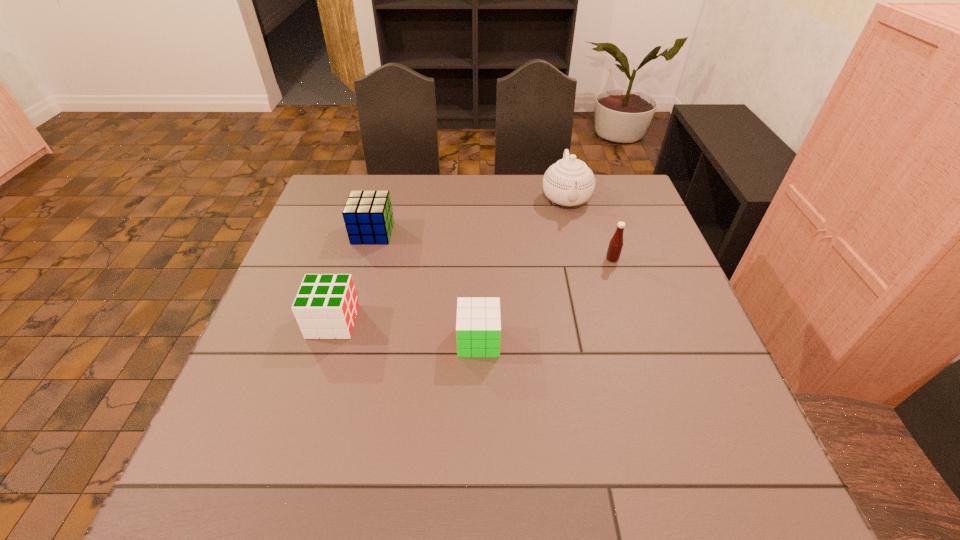
The image size is (960, 540). In order to click on free point that satisfies the following two spatial constraints: 1. on the spout of the tallest object; 2. on the right side of the third nearest object in this screenshot , I will do `click(581, 259)`.

This screenshot has height=540, width=960. I want to click on vacant space that satisfies the following two spatial constraints: 1. on the spout of the chinaware; 2. on the left side of the Tabasco sauce, so click(581, 259).

Where is `vacant space that satisfies the following two spatial constraints: 1. on the spout of the farthest object; 2. on the left side of the third nearest object`? This screenshot has width=960, height=540. vacant space that satisfies the following two spatial constraints: 1. on the spout of the farthest object; 2. on the left side of the third nearest object is located at coordinates (581, 259).